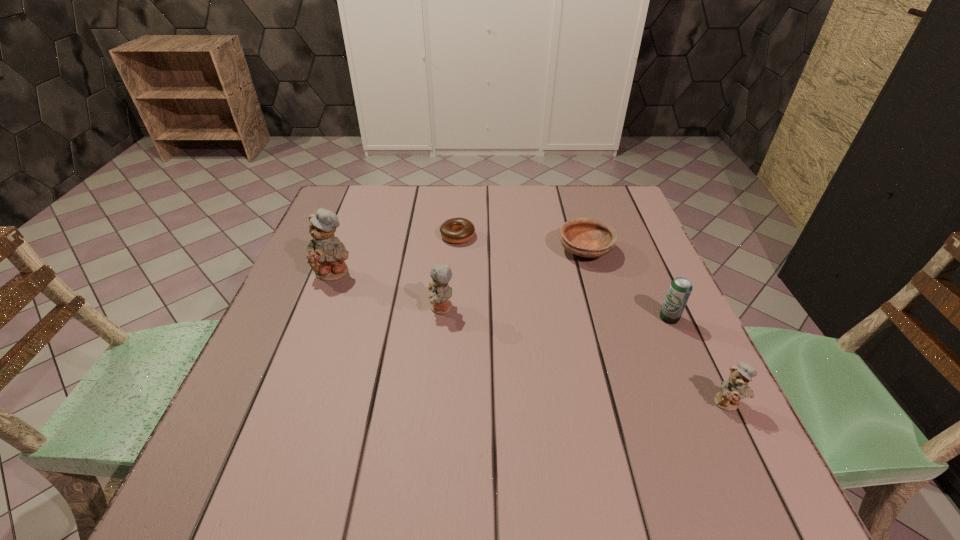
The width and height of the screenshot is (960, 540). What are the coordinates of `spot to insert another teddy_bear for uniform distribution` in the screenshot? It's located at (570, 350).